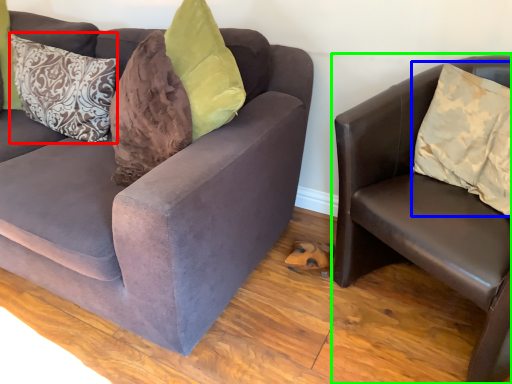
Question: Which object is the closest to the pillow (highlighted by a red box)? Choose among these: pillow (highlighted by a blue box) or studio couch (highlighted by a green box).

Choices:
 (A) pillow
 (B) studio couch

Answer: (B)